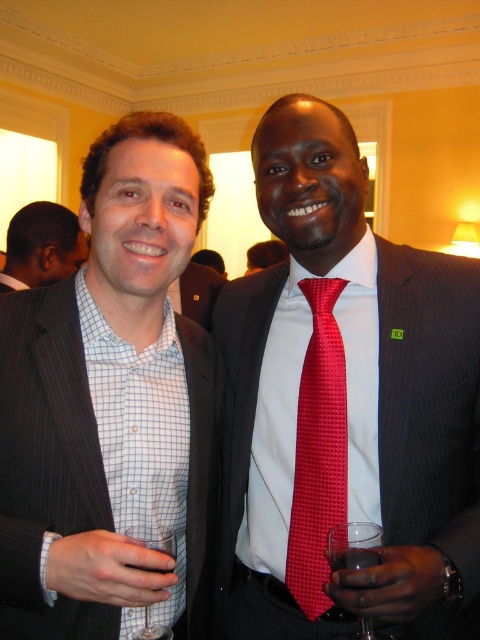
Question: Observing the image, what is the correct spatial positioning of matte black suit at center in reference to matte black suit at upper left?

Choices:
 (A) above
 (B) below

Answer: (B)

Question: Considering the real-world distances, which object is farthest from the matte black suit at upper left?

Choices:
 (A) clear glass at lower left
 (B) matte red tie at center
 (C) matte black suit at center

Answer: (A)

Question: Is transparent glass at right further to the viewer compared to clear glass at lower left?

Choices:
 (A) no
 (B) yes

Answer: (A)

Question: Among these points, which one is nearest to the camera?

Choices:
 (A) (151, 540)
 (B) (17, 253)
 (C) (323, 355)

Answer: (A)

Question: Which object appears closest to the camera in this image?

Choices:
 (A) clear glass at lower left
 (B) matte black suit at center

Answer: (B)

Question: Can you confirm if transparent glass at right is positioned to the right of clear glass at lower left?

Choices:
 (A) no
 (B) yes

Answer: (B)